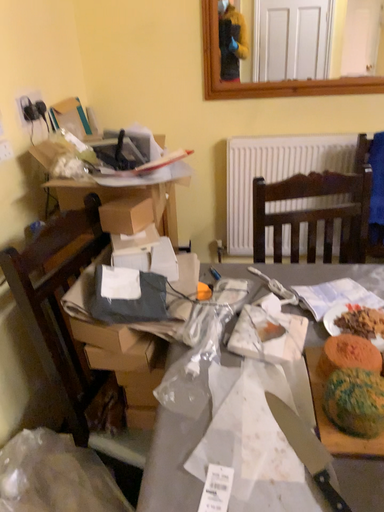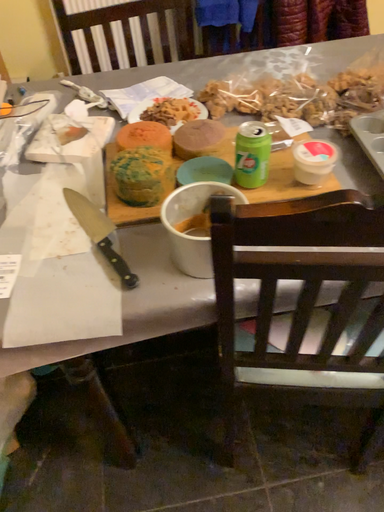
Question: Which way did the camera rotate in the video?

Choices:
 (A) rotated left
 (B) rotated right

Answer: (B)